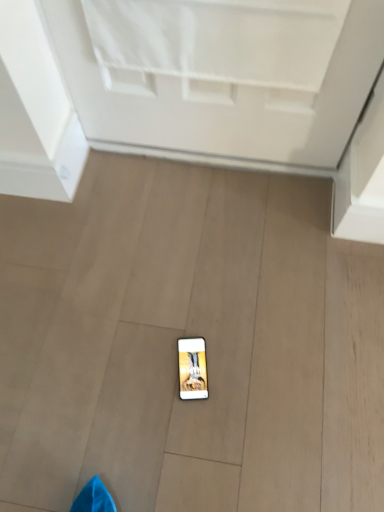
Find the location of a particular element. vacant position to the left of matte black phone at center is located at coordinates (132, 371).